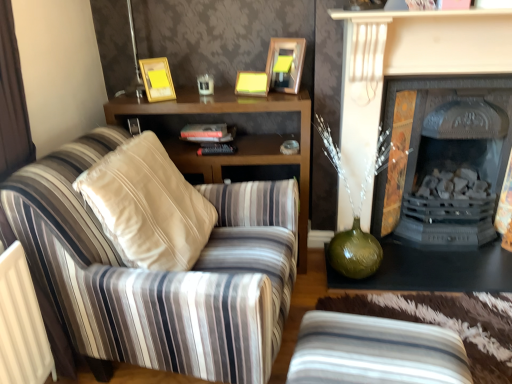
What is the approximate height of matte black fireplace at center, acting as the first fireplace starting from the front?

matte black fireplace at center, acting as the first fireplace starting from the front, is 3.77 feet tall.

The image size is (512, 384). What do you see at coordinates (160, 272) in the screenshot? I see `striped fabric armchair at left` at bounding box center [160, 272].

The image size is (512, 384). Identify the location of matte gold picture frame at upper center, the 1th picture frame from the right. (285, 64).

Image resolution: width=512 pixels, height=384 pixels. What are the coordinates of `matte black fireplace at center, acting as the second fireplace starting from the back` in the screenshot? It's located at (410, 61).

How different are the orientations of wooden cabinet at center and matte black fireplace at center, acting as the second fireplace starting from the back, in degrees?

The angle between the facing direction of wooden cabinet at center and the facing direction of matte black fireplace at center, acting as the second fireplace starting from the back, is 3.84 degrees.

From a real-world perspective, does wooden cabinet at center stand above matte black fireplace at center, acting as the first fireplace starting from the front?

No, from a real-world perspective, wooden cabinet at center is not above matte black fireplace at center, acting as the first fireplace starting from the front.

Does wooden cabinet at center appear on the right side of matte black fireplace at center, acting as the first fireplace starting from the front?

No, wooden cabinet at center is not to the right of matte black fireplace at center, acting as the first fireplace starting from the front.

Considering the positions of point (443, 122) and point (151, 94), is point (443, 122) closer or farther from the camera than point (151, 94)?

Clearly, point (443, 122) is more distant from the camera than point (151, 94).

Considering the sizes of objects black cast iron fireplace at right, which is counted as the 2th fireplace, starting from the front, and gold metallic picture frame at upper center, the first picture frame from the left, in the image provided, who is taller, black cast iron fireplace at right, which is counted as the 2th fireplace, starting from the front, or gold metallic picture frame at upper center, the first picture frame from the left,?

Standing taller between the two is black cast iron fireplace at right, which is counted as the 2th fireplace, starting from the front.

Is matte black fireplace at center, acting as the second fireplace starting from the back, taller or shorter than hardcover book at center?

Considering their sizes, matte black fireplace at center, acting as the second fireplace starting from the back, has more height than hardcover book at center.

From a real-world perspective, between matte black fireplace at center, acting as the first fireplace starting from the front, and hardcover book at center, who is vertically higher?

hardcover book at center is physically above.

Identify the location of book above the matte black fireplace at center, acting as the first fireplace starting from the front (from the image's perspective). (208, 133).

Considering the positions of objects matte black fireplace at center, acting as the first fireplace starting from the front, and hardcover book at center in the image provided, who is in front, matte black fireplace at center, acting as the first fireplace starting from the front, or hardcover book at center?

Positioned in front is matte black fireplace at center, acting as the first fireplace starting from the front.

Between hardcover book at center and wooden cabinet at center, which one has more height?

wooden cabinet at center is taller.

From the image's perspective, which is above, hardcover book at center or wooden cabinet at center?

hardcover book at center, from the image's perspective.

Measure the distance between hardcover book at center and wooden cabinet at center.

hardcover book at center and wooden cabinet at center are 8.44 inches apart.

Could you tell me if hardcover book at center is turned towards wooden cabinet at center?

Yes, hardcover book at center is oriented towards wooden cabinet at center.

Which is less distant, (298, 157) or (284, 50)?

Point (298, 157).

What's the angular difference between wooden cabinet at center and matte gold picture frame at upper center, marked as the second picture frame in a left-to-right arrangement,'s facing directions?

33.1 degrees.

Does wooden cabinet at center have a smaller size compared to matte gold picture frame at upper center, the 1th picture frame from the right?

Incorrect, wooden cabinet at center is not smaller in size than matte gold picture frame at upper center, the 1th picture frame from the right.

Could you tell me if wooden cabinet at center is facing matte gold picture frame at upper center, the 1th picture frame from the right?

No, wooden cabinet at center is not aimed at matte gold picture frame at upper center, the 1th picture frame from the right.

Is wooden cabinet at center shorter than hardcover book at center?

Incorrect, the height of wooden cabinet at center does not fall short of that of hardcover book at center.

In terms of size, does wooden cabinet at center appear bigger or smaller than hardcover book at center?

Clearly, wooden cabinet at center is larger in size than hardcover book at center.

From the picture: Which is farther from the camera, [241,146] or [203,131]?

The point [241,146] is farther from the camera.

From a real-world perspective, is wooden cabinet at center beneath hardcover book at center?

Yes, from a real-world perspective, wooden cabinet at center is below hardcover book at center.

How far apart are black cast iron fireplace at right, which is counted as the 2th fireplace, starting from the front, and striped fabric studio couch at lower center?

black cast iron fireplace at right, which is counted as the 2th fireplace, starting from the front, and striped fabric studio couch at lower center are 1.05 meters apart.

Who is taller, black cast iron fireplace at right, which ranks as the first fireplace in back-to-front order, or striped fabric studio couch at lower center?

black cast iron fireplace at right, which ranks as the first fireplace in back-to-front order, is taller.

Would you say black cast iron fireplace at right, which ranks as the first fireplace in back-to-front order, is to the left or to the right of striped fabric studio couch at lower center in the picture?

Based on their positions, black cast iron fireplace at right, which ranks as the first fireplace in back-to-front order, is located to the right of striped fabric studio couch at lower center.

Consider the image. From a real-world perspective, is black cast iron fireplace at right, which is counted as the 2th fireplace, starting from the front, positioned over striped fabric studio couch at lower center based on gravity?

Yes, from a real-world perspective, black cast iron fireplace at right, which is counted as the 2th fireplace, starting from the front, is on top of striped fabric studio couch at lower center.

This screenshot has height=384, width=512. Identify the location of cabinetry behind the matte black fireplace at center, acting as the second fireplace starting from the back. (234, 141).

From the image's perspective, which picture frame is the 1st one above the black cast iron fireplace at right, which ranks as the first fireplace in back-to-front order? Please provide its 2D coordinates.

[(157, 79)]

Considering their positions, is gold metallic picture frame at upper center, the first picture frame from the left, positioned closer to black cast iron fireplace at right, which ranks as the first fireplace in back-to-front order, than matte gold picture frame at upper center, the 1th picture frame from the right?

Based on the image, matte gold picture frame at upper center, the 1th picture frame from the right, appears to be nearer to black cast iron fireplace at right, which ranks as the first fireplace in back-to-front order.

Which object lies nearer to the anchor point hardcover book at center, wooden cabinet at center or black cast iron fireplace at right, which ranks as the first fireplace in back-to-front order?

The object closer to hardcover book at center is wooden cabinet at center.

In the scene shown: Looking at the image, which one is located closer to striped fabric studio couch at lower center, black cast iron fireplace at right, which ranks as the first fireplace in back-to-front order, or matte black fireplace at center, acting as the second fireplace starting from the back?

matte black fireplace at center, acting as the second fireplace starting from the back, lies closer to striped fabric studio couch at lower center than the other object.

Estimate the real-world distances between objects in this image. Which object is further from wooden cabinet at center, matte black fireplace at center, acting as the first fireplace starting from the front, or hardcover book at center?

The object further to wooden cabinet at center is matte black fireplace at center, acting as the first fireplace starting from the front.

Which object lies nearer to the anchor point striped fabric studio couch at lower center, gold metallic picture frame at upper center, the first picture frame from the left, or black cast iron fireplace at right, which is counted as the 2th fireplace, starting from the front?

black cast iron fireplace at right, which is counted as the 2th fireplace, starting from the front, lies closer to striped fabric studio couch at lower center than the other object.

From the image, which object appears to be farther from matte gold picture frame at upper center, the 1th picture frame from the right, matte black fireplace at center, acting as the first fireplace starting from the front, or hardcover book at center?

The object further to matte gold picture frame at upper center, the 1th picture frame from the right, is matte black fireplace at center, acting as the first fireplace starting from the front.

Looking at the image, which one is located closer to hardcover book at center, gold metallic picture frame at upper center, which ranks as the second picture frame in right-to-left order, or striped fabric studio couch at lower center?

Based on the image, gold metallic picture frame at upper center, which ranks as the second picture frame in right-to-left order, appears to be nearer to hardcover book at center.

When comparing their distances from striped fabric armchair at left, does black cast iron fireplace at right, which is counted as the 2th fireplace, starting from the front, or gold metallic picture frame at upper center, the first picture frame from the left, seem further?

The object further to striped fabric armchair at left is black cast iron fireplace at right, which is counted as the 2th fireplace, starting from the front.

Identify the location of chair located between gold metallic picture frame at upper center, which ranks as the second picture frame in right-to-left order, and black cast iron fireplace at right, which ranks as the first fireplace in back-to-front order, in the left-right direction. (160, 272).

Identify the location of picture frame between striped fabric armchair at left and gold metallic picture frame at upper center, which ranks as the second picture frame in right-to-left order, in the front-back direction. The width and height of the screenshot is (512, 384). (285, 64).

Find the location of a particular element. picture frame between matte gold picture frame at upper center, marked as the second picture frame in a left-to-right arrangement, and wooden cabinet at center from top to bottom is located at coordinates (157, 79).

Locate an element on the screen. Image resolution: width=512 pixels, height=384 pixels. picture frame between hardcover book at center and matte black fireplace at center, acting as the first fireplace starting from the front, from left to right is located at coordinates (285, 64).